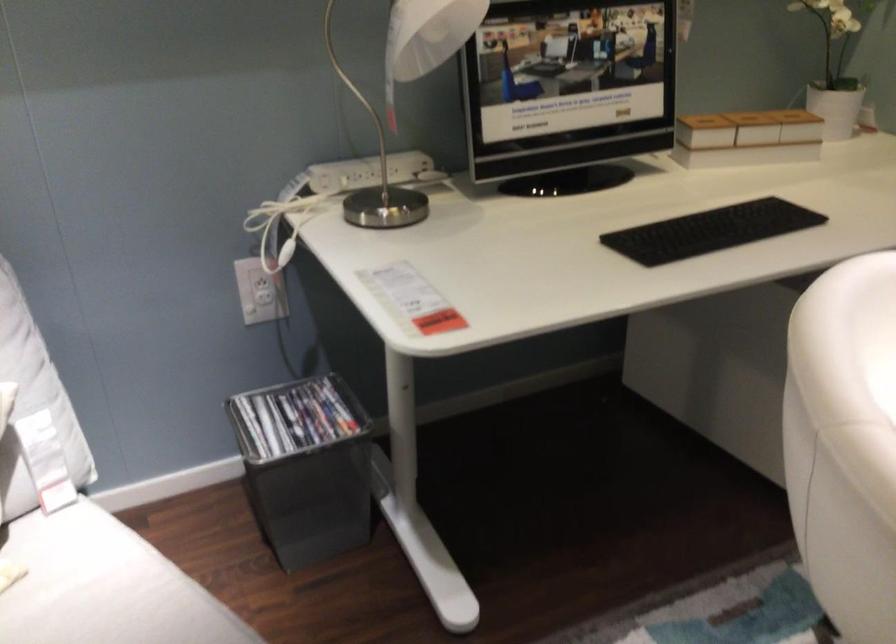
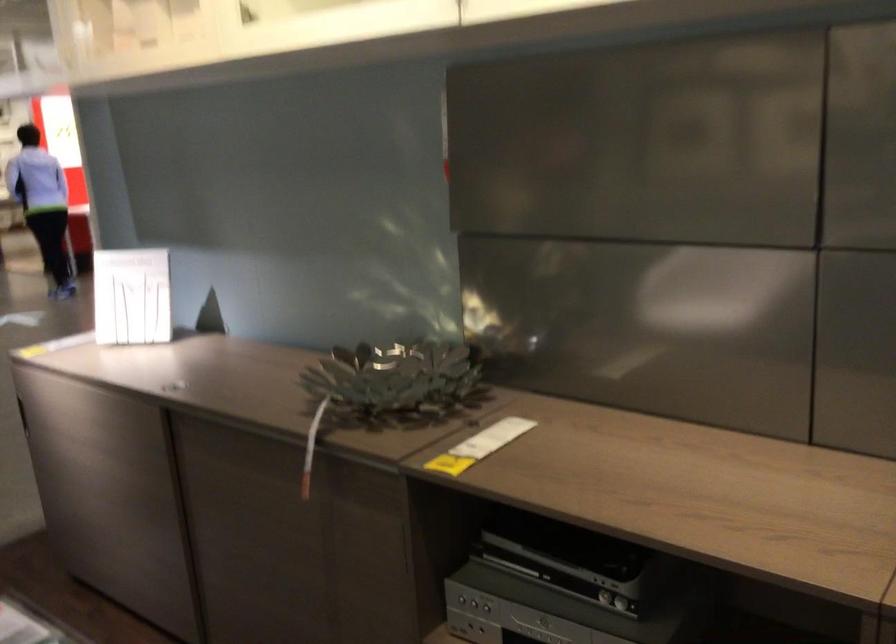
The images are taken continuously from a first-person perspective. In which direction is your viewpoint rotating?

The camera rotated toward right-down.